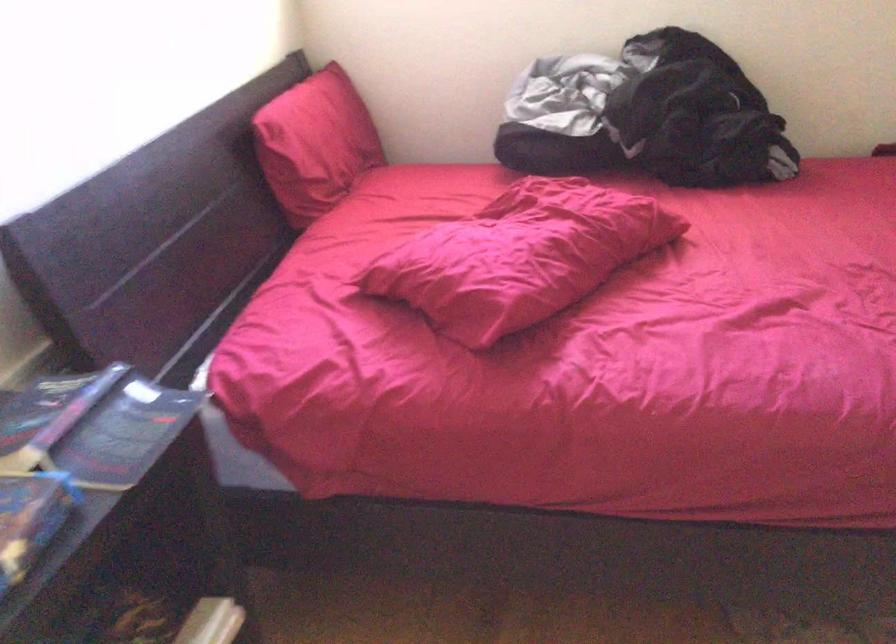
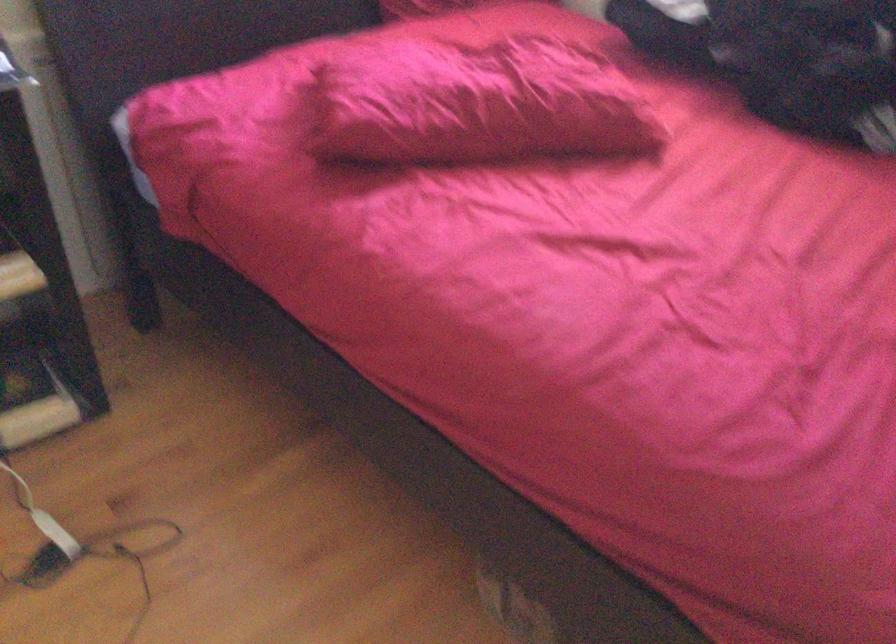
The point at (567, 248) is marked in the first image. Where is the corresponding point in the second image?

(477, 104)